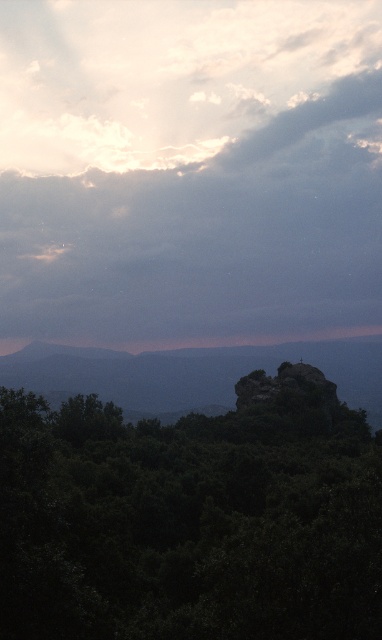
You are a bird flying in the cloudy sky at upper center. You want to land on the green leafy tree at center. Is the tree below the sky?

The cloudy sky at upper center is taller than green leafy tree at center, so yes, the green leafy tree at center is below the cloudy sky at upper center.